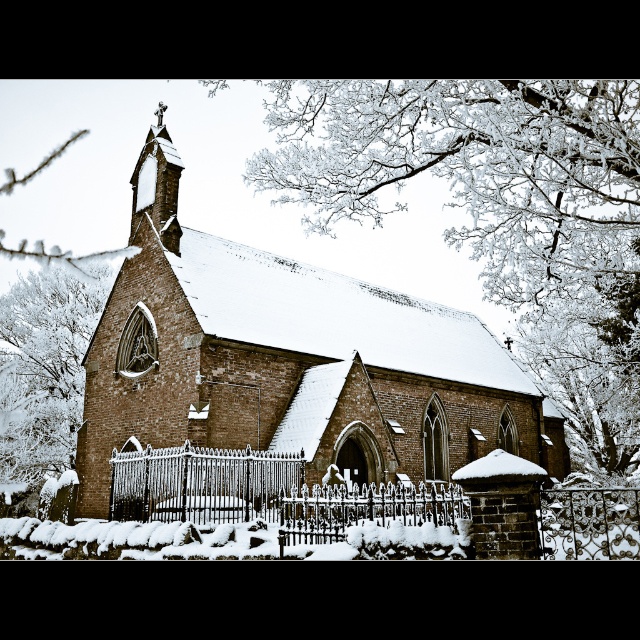
Is point (218, 502) positioned after point (214, 522)?

Yes.

Measure the distance between point (173, 470) and camera.

Point (173, 470) is 158.20 feet from camera.

Where is `silver wrought iron fence at center`? Image resolution: width=640 pixels, height=640 pixels. silver wrought iron fence at center is located at coordinates (276, 493).

Between point (64, 388) and point (220, 467), which one is positioned in front?

Point (220, 467) is more forward.

Locate an element on the screen. This screenshot has height=640, width=640. white frosty branches at left is located at coordinates (44, 368).

Which is below, brown brick church at center or white frosty branches at left?

brown brick church at center is below.

Does brown brick church at center have a larger size compared to white frosty branches at left?

Yes.

Is point (160, 240) positioned after point (29, 285)?

No, it is not.

Where is `brown brick church at center`? This screenshot has height=640, width=640. brown brick church at center is located at coordinates (289, 362).